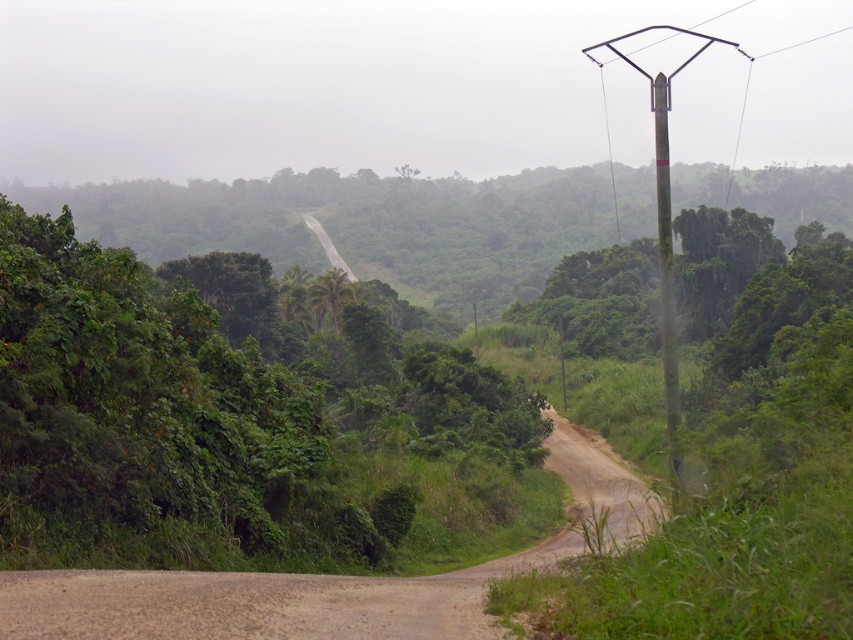
Question: Observing the image, what is the correct spatial positioning of brown dirt track at center in reference to green textured pole at right?

Choices:
 (A) left
 (B) right

Answer: (A)

Question: Is brown dirt track at center to the right of green textured pole at right from the viewer's perspective?

Choices:
 (A) yes
 (B) no

Answer: (B)

Question: Can you confirm if green leafy tree at center is wider than brown dirt track at center?

Choices:
 (A) yes
 (B) no

Answer: (A)

Question: Which object is farther from the camera taking this photo?

Choices:
 (A) green textured pole at right
 (B) brown dirt track at center
 (C) green leafy tree at center

Answer: (C)

Question: Which object is positioned closest to the green textured pole at right?

Choices:
 (A) green leafy tree at center
 (B) brown dirt track at center

Answer: (A)

Question: Which of these objects is positioned closest to the brown dirt track at center?

Choices:
 (A) green leafy tree at center
 (B) green textured pole at right

Answer: (A)